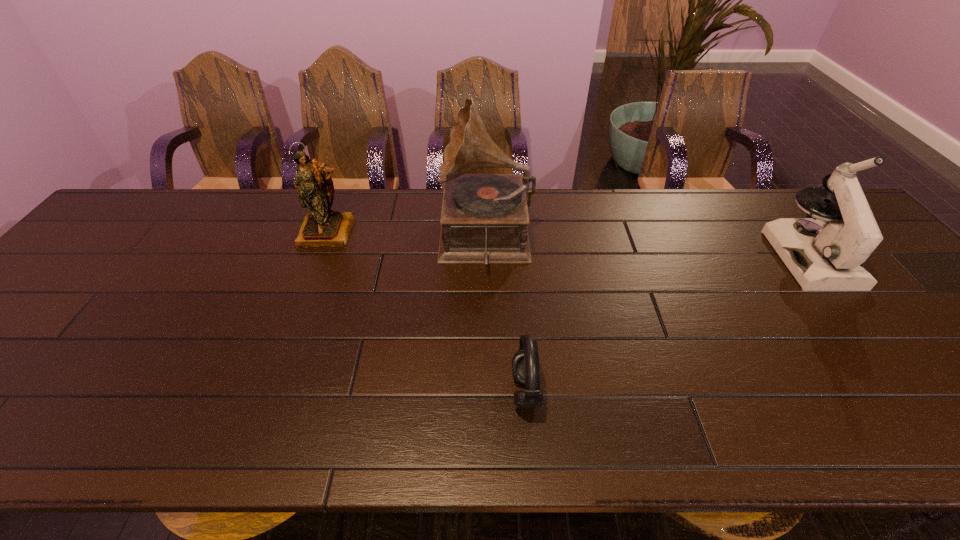
You are a GUI agent. You are given a task and a screenshot of the screen. Output one action in this format:
    pyautogui.click(x=<x>, y=<y>)
    Task: Click on the tallest object
    
    Given the screenshot: What is the action you would take?
    pyautogui.click(x=484, y=217)

Locate an element on the screen. microscope is located at coordinates (824, 252).

Identify the location of the leftmost object. (322, 227).

This screenshot has width=960, height=540. In order to click on the nearest object in this screenshot , I will do `click(525, 364)`.

Identify the location of the shortest object. (525, 364).

Identify the location of vacant region located from the horn of the record player. (371, 240).

The width and height of the screenshot is (960, 540). I want to click on free space located from the horn of the record player, so click(x=384, y=240).

Identify the location of free region located 0.220m from the horn of the record player. This screenshot has height=540, width=960. (363, 240).

At what (x,y) coordinates should I click in order to perform the action: click on free location located 0.360m at the eyepiece of the microscope. Please return your answer as a coordinate pair (x, y). Looking at the image, I should click on (941, 423).

What are the coordinates of `free spot located on the front-facing side of the figurine` in the screenshot? It's located at (302, 300).